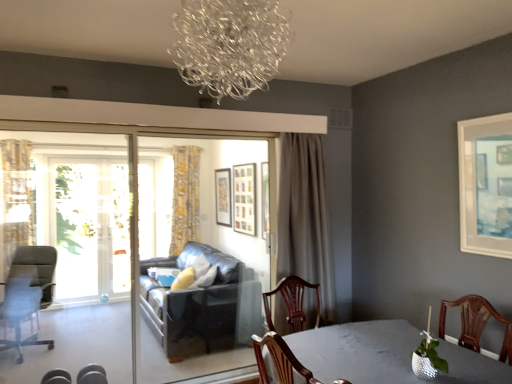
Find the location of a particular element. vacant location behind metallic silver chair at lower left, arranged as the 3th chair when viewed from the left is located at coordinates (102, 376).